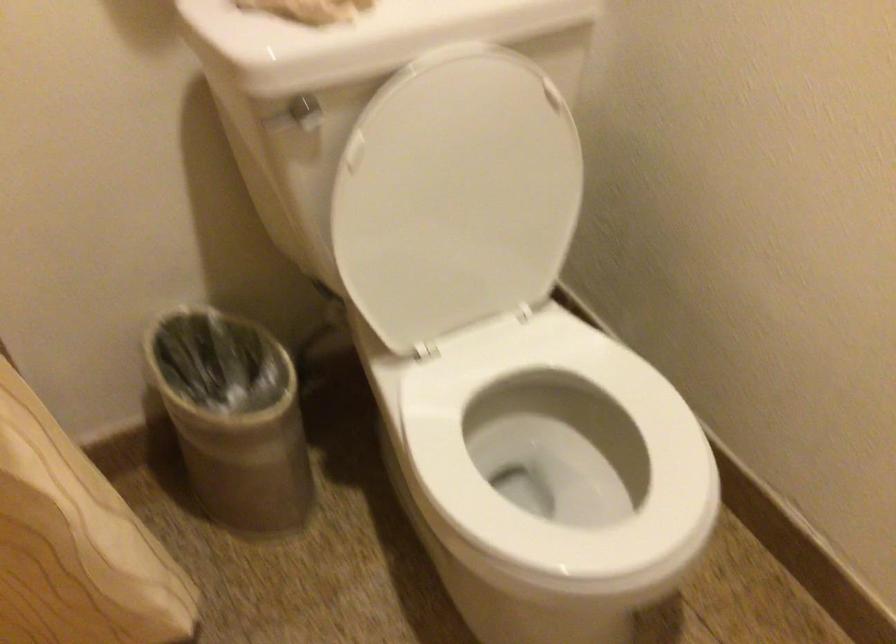
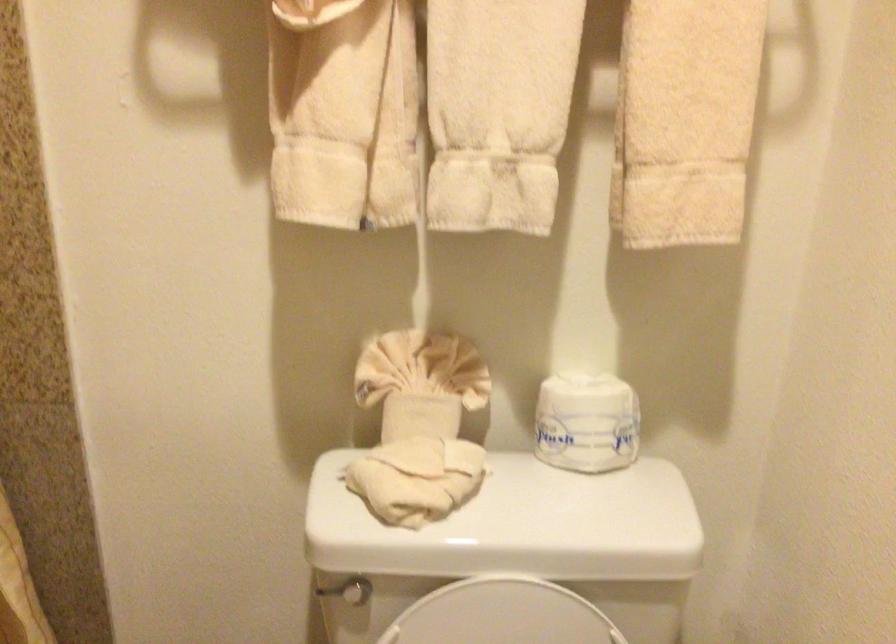
Find the pixel in the second image that matches (269,128) in the first image.

(326, 590)